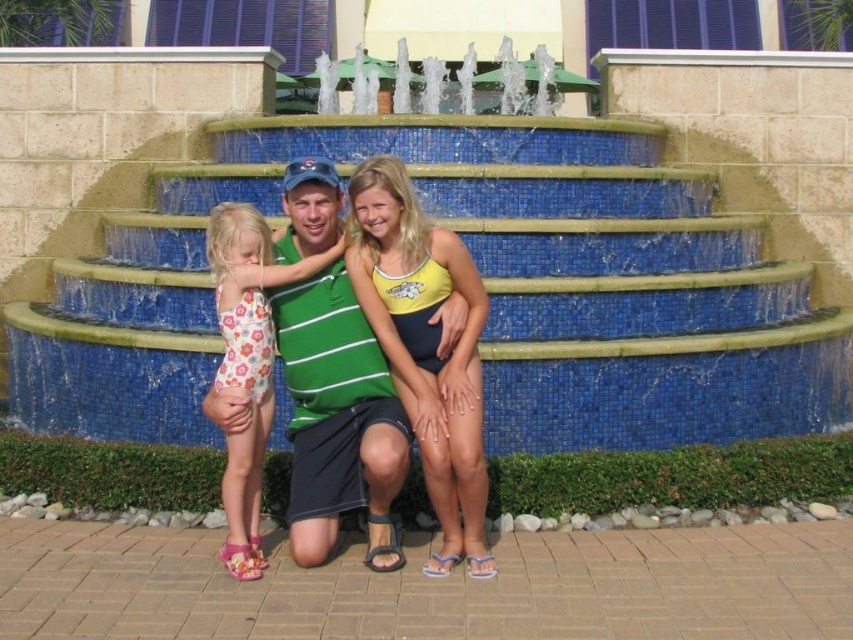
Question: Which point appears closest to the camera in this image?

Choices:
 (A) (480, 278)
 (B) (328, 500)
 (C) (247, 317)
 (D) (209, 358)

Answer: (B)

Question: Which point is closer to the camera taking this photo?

Choices:
 (A) (268, 330)
 (B) (18, 324)
 (C) (302, 550)
 (D) (456, 557)

Answer: (C)

Question: Is green striped shirt at center further to the viewer compared to yellow fabric bikini top at center?

Choices:
 (A) yes
 (B) no

Answer: (B)

Question: Which point is farther to the camera?

Choices:
 (A) (550, 272)
 (B) (462, 554)
 (C) (225, 276)

Answer: (A)

Question: Is green striped shirt at center below floral print swimsuit at left?

Choices:
 (A) yes
 (B) no

Answer: (A)

Question: Can you confirm if green striped shirt at center is wider than floral print swimsuit at left?

Choices:
 (A) no
 (B) yes

Answer: (A)